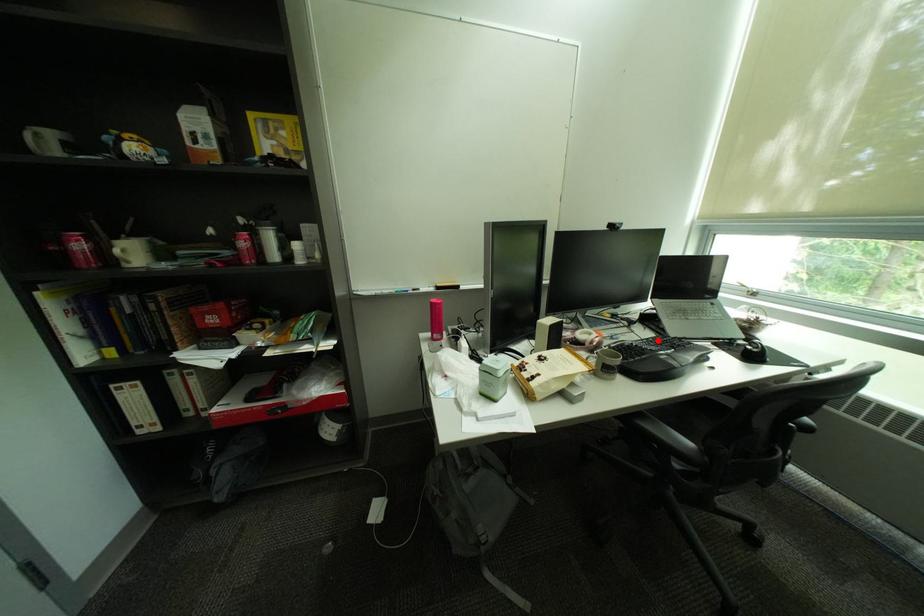
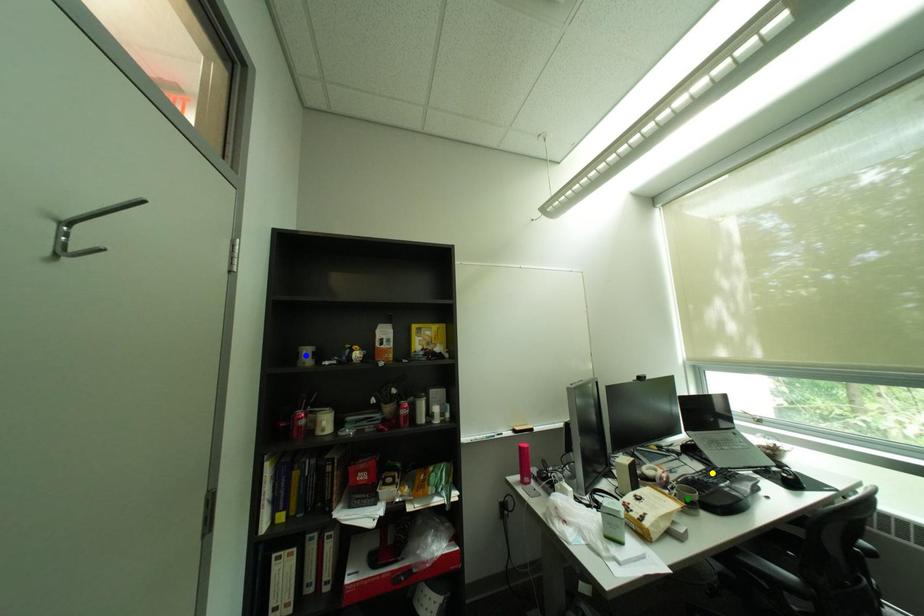
Question: I am providing you with two images of the same scene from different viewpoints. A red point is marked on the first image. You are given multiple points on the second image. Which point in image 2 represents the same 3d spot as the red point in image 1?

Choices:
 (A) green point
 (B) yellow point
 (C) blue point

Answer: (B)